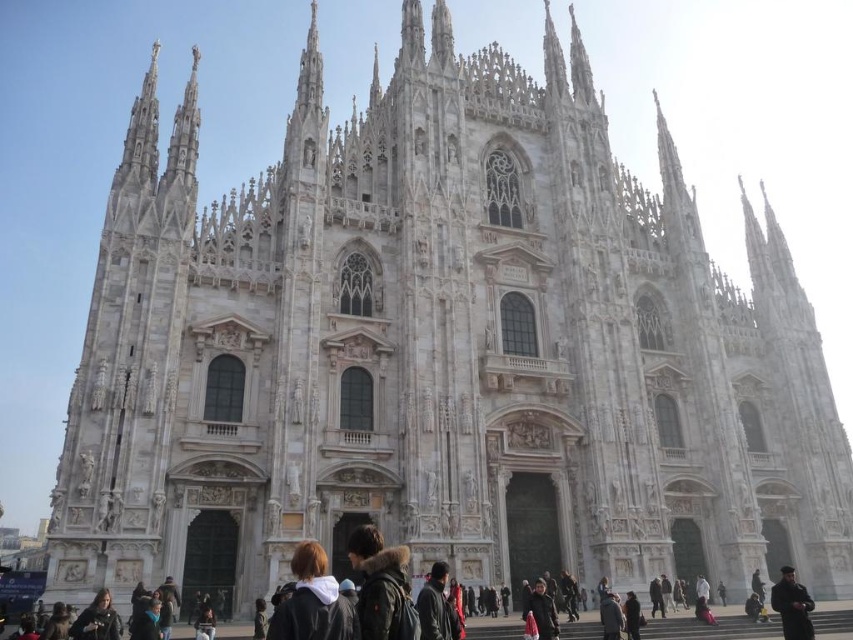
Question: Based on their relative distances, which object is nearer to the dark gray jacket at center?

Choices:
 (A) dark brown leather jacket at lower center
 (B) dark brown hair at lower center
 (C) black leather jacket at lower right

Answer: (B)

Question: Is dark brown hair at lower center thinner than dark brown fur-lined jacket at center?

Choices:
 (A) no
 (B) yes

Answer: (A)

Question: Which of the following is the closest to the observer?

Choices:
 (A) dark brown hair at lower center
 (B) dark gray jacket at center

Answer: (A)

Question: Does dark gray jacket at center have a larger size compared to dark brown leather jacket at lower left?

Choices:
 (A) no
 (B) yes

Answer: (B)

Question: Can you confirm if dark gray jacket at center is positioned to the right of dark brown leather jacket at lower left?

Choices:
 (A) no
 (B) yes

Answer: (B)

Question: Which point is farther to the camera?

Choices:
 (A) (339, 598)
 (B) (364, 627)
 (C) (544, 637)

Answer: (C)